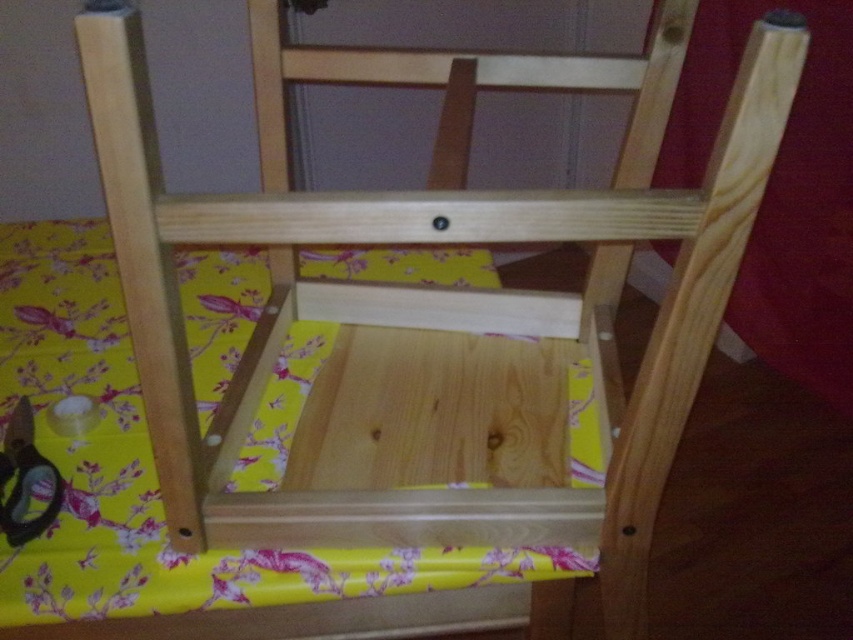
Question: Which point is farther to the camera?

Choices:
 (A) yellow floral fabric at center
 (B) metallic sheen scissors at lower left

Answer: (B)

Question: Is yellow floral fabric at center closer to the viewer compared to metallic sheen scissors at lower left?

Choices:
 (A) yes
 (B) no

Answer: (A)

Question: From the image, what is the correct spatial relationship of yellow floral fabric at center in relation to metallic sheen scissors at lower left?

Choices:
 (A) below
 (B) above

Answer: (B)

Question: Which point appears farthest from the camera in this image?

Choices:
 (A) (4, 316)
 (B) (3, 515)

Answer: (A)

Question: Which object is closer to the camera taking this photo?

Choices:
 (A) metallic sheen scissors at lower left
 (B) yellow floral fabric at center

Answer: (B)

Question: Is yellow floral fabric at center bigger than metallic sheen scissors at lower left?

Choices:
 (A) no
 (B) yes

Answer: (B)